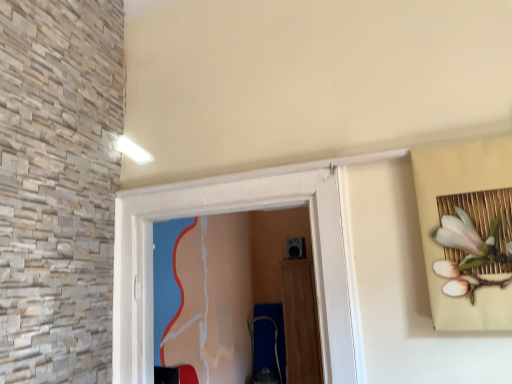
Question: Should I look upward or downward to see wooden door at center?

Choices:
 (A) up
 (B) down

Answer: (B)